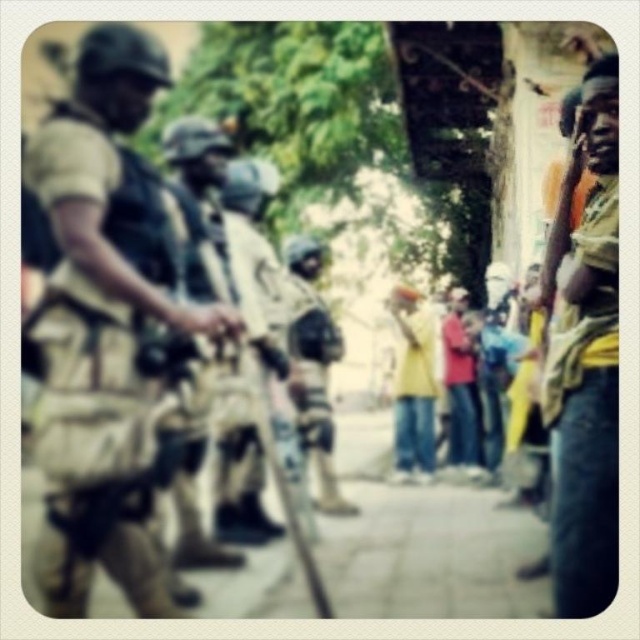
You are a photographer trying to capture both the tan uniform at left and the camouflage fabric shirt at right in a single frame. Given their sizes, which one might appear closer to the camera in the photo?

The tan uniform at left is larger in size compared to the camouflage fabric shirt at right, so it would appear closer to the camera in the photo since larger objects typically appear nearer when viewed from the same distance.

You are a security analyst reviewing this image for situational awareness. Based on the positions of the tan uniform at left and the camouflage fabric shirt at right, which individual is positioned higher in the frame?

The tan uniform at left is positioned higher in the frame than the camouflage fabric shirt at right, as it is located above it.

In the urban scene with law enforcement and civilians, there is a tan uniform at left and a camouflage fabric shirt at right. Which object is taller?

The tan uniform at left is much taller than the camouflage fabric shirt at right.